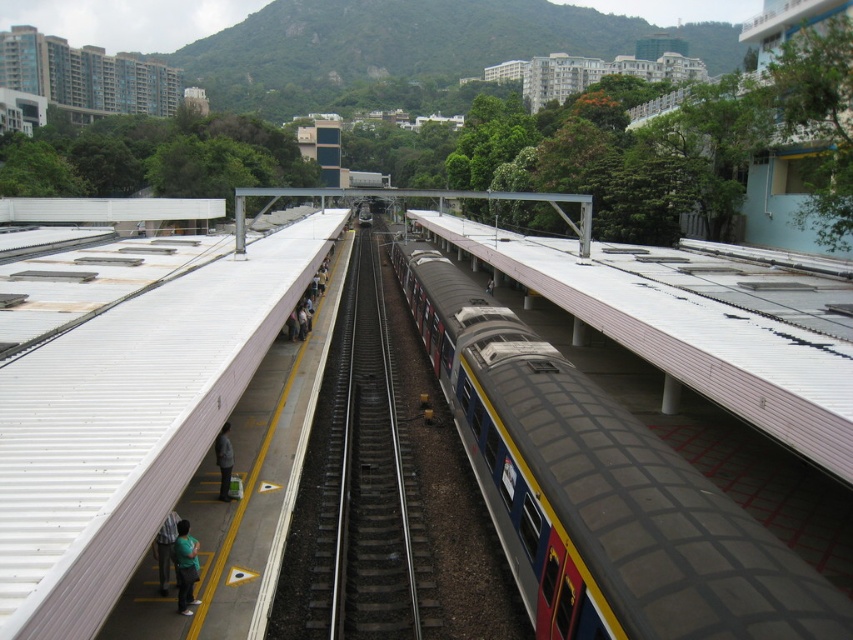
Is black metal train track at center to the left of green fabric shirt at left from the viewer's perspective?

In fact, black metal train track at center is to the right of green fabric shirt at left.

Is point (376, 541) positioned in front of point (225, 481)?

That is True.

Find the location of a particular element. The height and width of the screenshot is (640, 853). black metal train track at center is located at coordinates (366, 483).

Where is `black metal train track at center`? The width and height of the screenshot is (853, 640). black metal train track at center is located at coordinates (366, 483).

Is the position of metallic gray train at center more distant than that of dark gray jacket at lower left?

No, metallic gray train at center is closer to the viewer.

Is point (517, 408) positioned behind point (165, 516)?

Yes.

The width and height of the screenshot is (853, 640). I want to click on metallic gray train at center, so click(599, 492).

Between point (177, 532) and point (227, 426), which one is positioned in front?

Positioned in front is point (177, 532).

Does green fabric shirt at lower left have a greater width compared to green fabric shirt at left?

Yes, green fabric shirt at lower left is wider than green fabric shirt at left.

Is point (177, 576) closer to camera compared to point (225, 460)?

That is True.

The image size is (853, 640). Identify the location of green fabric shirt at lower left. point(184,566).